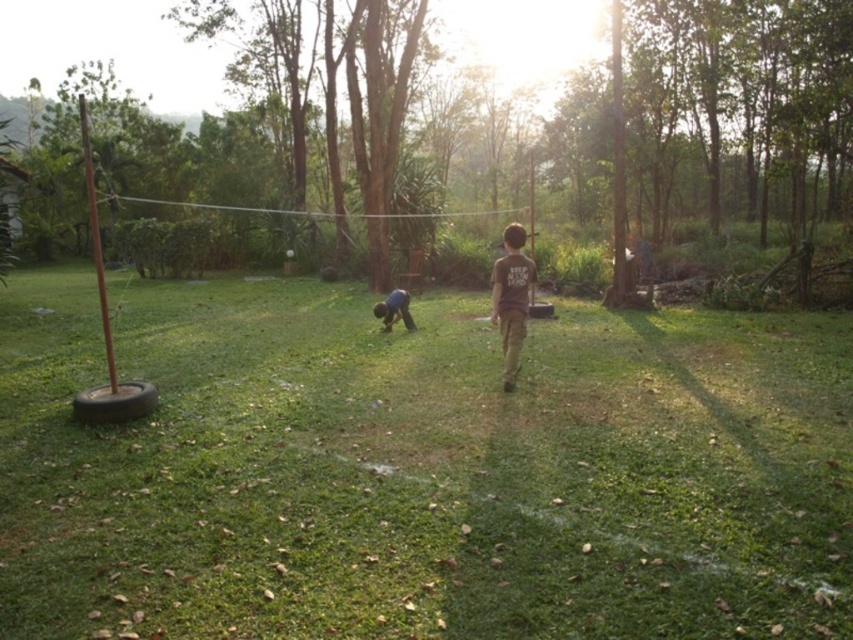
Can you confirm if green grass at center is positioned below dark blue fabric at center?

Correct, green grass at center is located below dark blue fabric at center.

Who is taller, green grass at center or dark blue fabric at center?

green grass at center

Locate an element on the screen. This screenshot has height=640, width=853. green grass at center is located at coordinates (418, 468).

Who is shorter, brown cotton shirt at center or dark blue fabric at center?

dark blue fabric at center

Which is behind, point (500, 312) or point (379, 304)?

Point (379, 304)

What do you see at coordinates (511, 298) in the screenshot? This screenshot has height=640, width=853. I see `brown cotton shirt at center` at bounding box center [511, 298].

Where is `brown cotton shirt at center`? The image size is (853, 640). brown cotton shirt at center is located at coordinates (511, 298).

Which is below, green grass at center or brown cotton shirt at center?

Positioned lower is green grass at center.

Locate an element on the screen. green grass at center is located at coordinates (418, 468).

Find the location of a particular element. This screenshot has width=853, height=640. green grass at center is located at coordinates (418, 468).